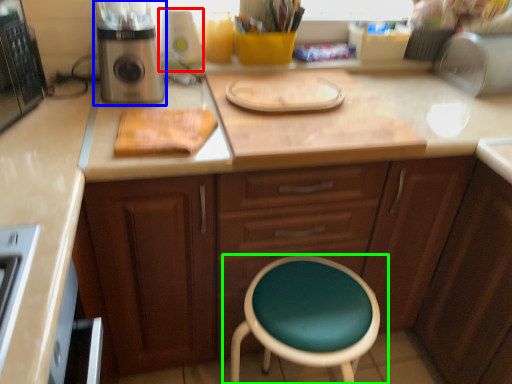
Question: Considering the real-world distances, which object is farthest from appliance (highlighted by a red box)? kitchen appliance (highlighted by a blue box) or chair (highlighted by a green box)?

Choices:
 (A) kitchen appliance
 (B) chair

Answer: (B)